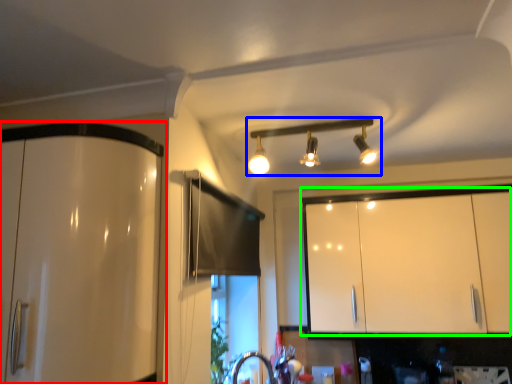
Question: Which object is positioned closest to cabinetry (highlighted by a red box)? Select from lamp (highlighted by a blue box) and cabinetry (highlighted by a green box).

Choices:
 (A) lamp
 (B) cabinetry

Answer: (A)